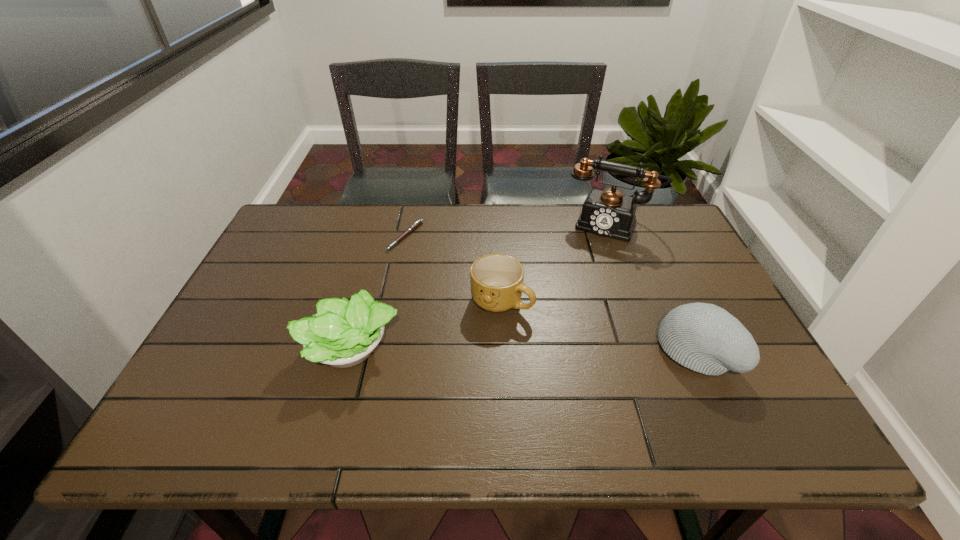
You are a GUI agent. You are given a task and a screenshot of the screen. Output one action in this format:
    pyautogui.click(x=<x>, y=<y>)
    Task: Click on the beanie that is at the right edge
    
    Given the screenshot: What is the action you would take?
    point(705,338)

At what (x,y) coordinates should I click in order to perform the action: click on telephone positioned at the right edge. Please return your answer as a coordinate pair (x, y). Looking at the image, I should click on (609, 213).

I want to click on object situated at the far right corner, so click(609, 213).

Find the location of a particular element. The width and height of the screenshot is (960, 540). object at the near right corner is located at coordinates (705, 338).

At what (x,y) coordinates should I click in order to perform the action: click on free space at the far edge. Please return your answer as a coordinate pair (x, y). The height and width of the screenshot is (540, 960). Looking at the image, I should click on (537, 244).

Where is `blank space at the left edge of the desktop`? blank space at the left edge of the desktop is located at coordinates (284, 279).

You are a GUI agent. You are given a task and a screenshot of the screen. Output one action in this format:
    pyautogui.click(x=<x>, y=<y>)
    Task: Click on the vacant area at the right edge of the desktop
    This screenshot has height=540, width=960.
    Given the screenshot: What is the action you would take?
    pyautogui.click(x=646, y=255)

Where is `vacant space at the far left corner of the desktop`? The image size is (960, 540). vacant space at the far left corner of the desktop is located at coordinates (321, 239).

Identify the location of vacant space at the far right corner of the desktop. (659, 241).

Image resolution: width=960 pixels, height=540 pixels. What are the coordinates of `vacant space at the near right corner` in the screenshot? It's located at (739, 388).